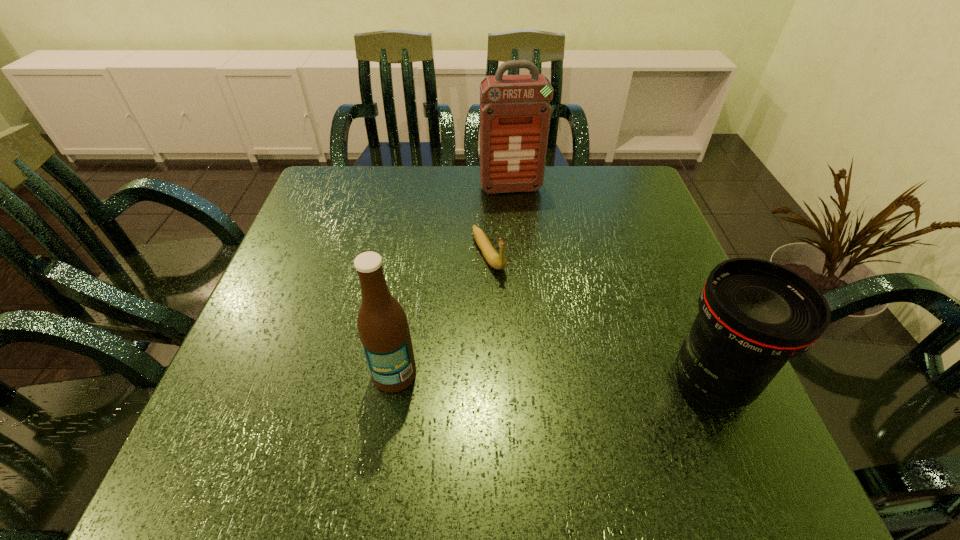
Locate an element on the screen. The image size is (960, 540). the leftmost object is located at coordinates (382, 324).

Locate an element on the screen. beer bottle is located at coordinates (382, 324).

Locate an element on the screen. The image size is (960, 540). telephoto lens is located at coordinates coord(754,315).

Where is `the rightmost object`? The image size is (960, 540). the rightmost object is located at coordinates (754, 315).

Where is `the tallest object`? Image resolution: width=960 pixels, height=540 pixels. the tallest object is located at coordinates (x=515, y=112).

The image size is (960, 540). I want to click on the farthest object, so click(x=515, y=112).

In order to click on banana in this screenshot , I will do point(496,261).

You are a GUI agent. You are given a task and a screenshot of the screen. Output one action in this format:
    pyautogui.click(x=<x>, y=<y>)
    Task: Click on the third nearest object
    
    Given the screenshot: What is the action you would take?
    pyautogui.click(x=496, y=261)

You are a GUI agent. You are given a task and a screenshot of the screen. Output one action in this format:
    pyautogui.click(x=<x>, y=<y>)
    Task: Click on the blank area located 0.070m on the back of the third shortest object
    The height and width of the screenshot is (540, 960).
    Given the screenshot: What is the action you would take?
    pyautogui.click(x=402, y=326)

I want to click on vacant space located 0.320m on the left of the second shortest object, so click(x=488, y=381).